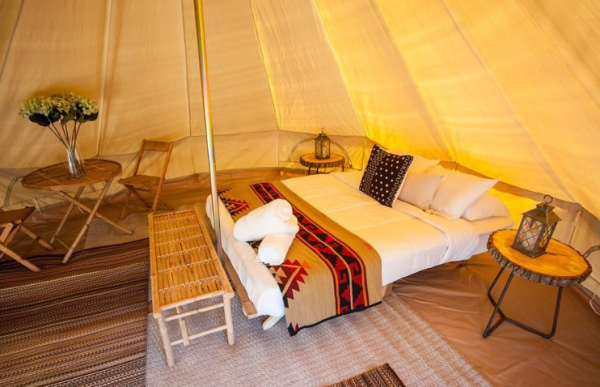
You are a GUI agent. You are given a task and a screenshot of the screen. Output one action in this format:
    pyautogui.click(x=<x>, y=<y>)
    Task: Click on the vase
    
    Given the screenshot: What is the action you would take?
    pyautogui.click(x=77, y=162)